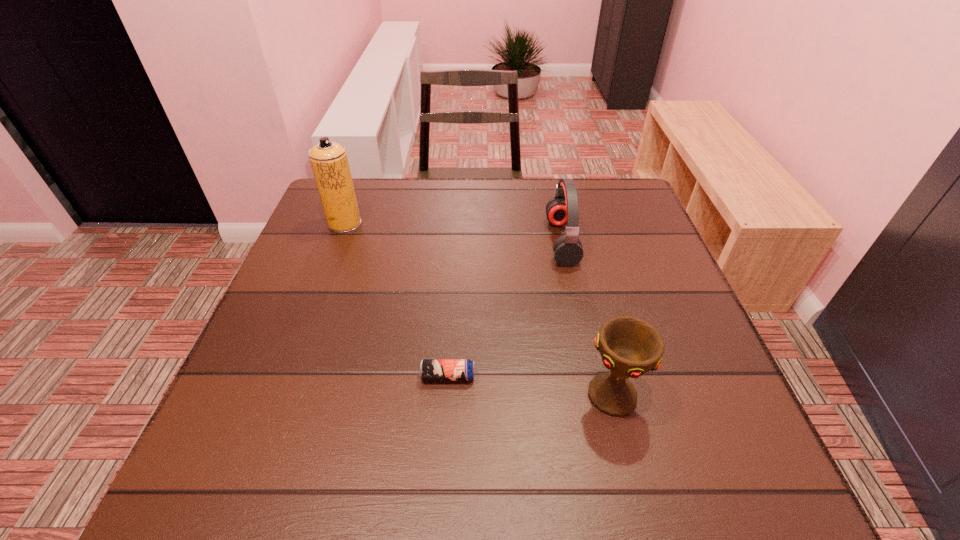
Locate an element on the screen. aerosol can is located at coordinates [x=329, y=162].

Identify the location of the leftmost object. Image resolution: width=960 pixels, height=540 pixels. (329, 162).

At what (x,y) coordinates should I click in order to perform the action: click on earphone. Please return your answer as a coordinate pair (x, y). Image resolution: width=960 pixels, height=540 pixels. Looking at the image, I should click on (563, 209).

Identify the location of chalice. (630, 347).

Locate an element on the screen. the second object from left to right is located at coordinates coord(430,369).

Identify the location of the shortest object. (430, 369).

Where is `free space located 0.390m on the right of the leftmost object`? free space located 0.390m on the right of the leftmost object is located at coordinates [506, 224].

Locate an element on the screen. This screenshot has width=960, height=540. free space located 0.240m on the ear cups of the earphone is located at coordinates (454, 241).

Locate an element on the screen. vacant area situated on the ear cups of the earphone is located at coordinates (513, 241).

Where is `free space located on the ear cups of the earphone`? The width and height of the screenshot is (960, 540). free space located on the ear cups of the earphone is located at coordinates (443, 241).